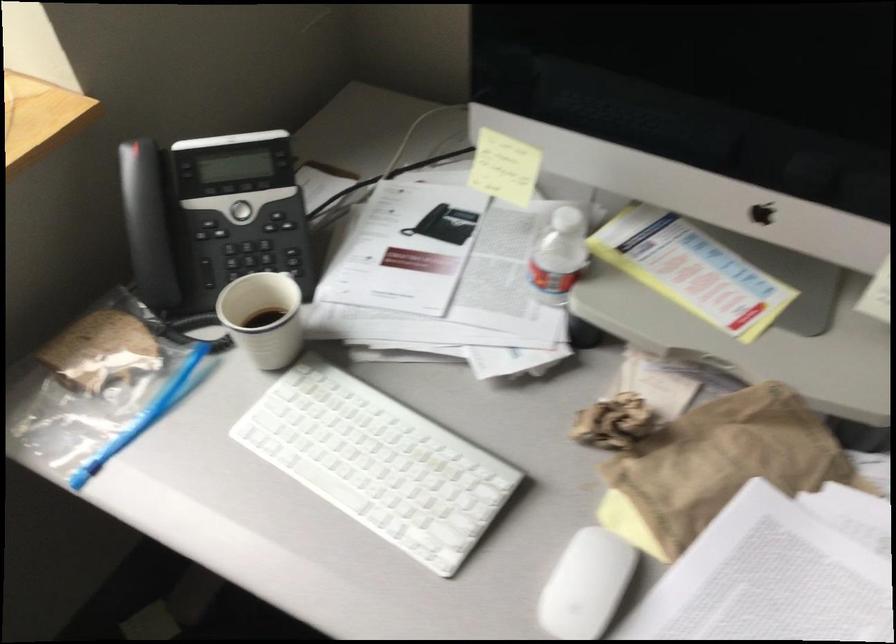
Which object does [263,317] point to?

It refers to a white paper cup.